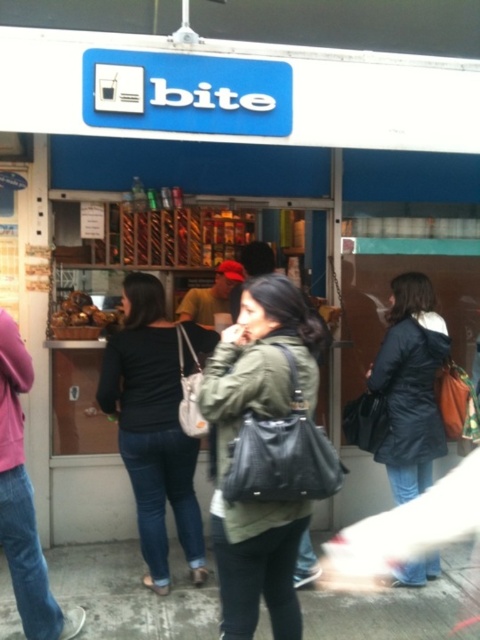
You are a delivery person who needs to place a small package between the matte black bag at center and the denim jeans at left. Based on the scene, can you fit the package between them?

The matte black bag at center is shorter than denim jeans at left, so there might be enough vertical space to place the package between them.

You are a customer waiting in line at the food stall named bite. You notice two people in front of you wearing jackets. The first person is wearing a black leather jacket at center and the second is wearing a dark blue coat at center. Which jacket is taller?

The black leather jacket at center is taller than the dark blue coat at center.

You are a delivery person who needs to place a package in a bag. You have a small package that can fit into either the matte black bag at center or the denim jeans at left. Which bag should you choose?

The matte black bag at center is bigger than the denim jeans at left, so you should choose the matte black bag at center to place the small package.